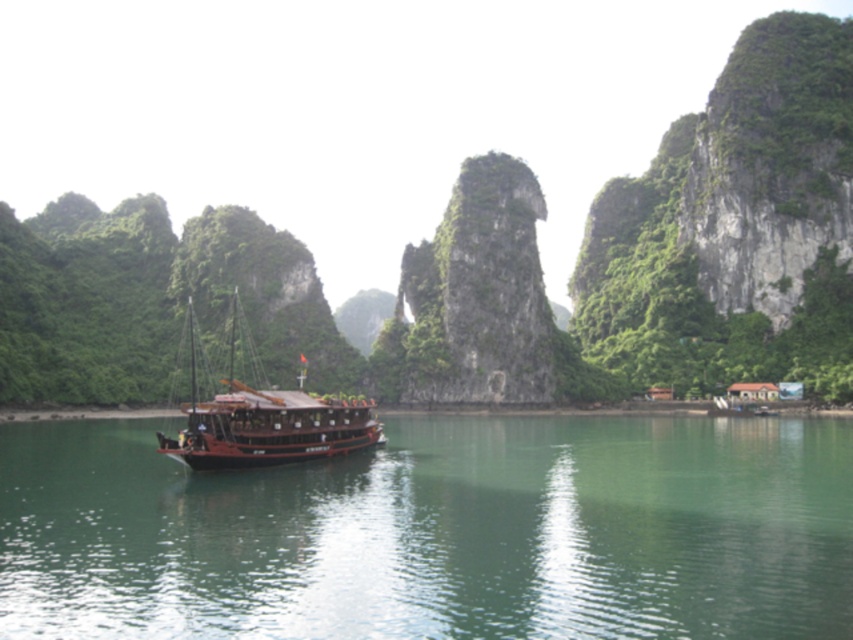
Question: Does green smooth water at center have a greater width compared to wooden ship at center?

Choices:
 (A) no
 (B) yes

Answer: (B)

Question: Which point is closer to the camera?

Choices:
 (A) (579, 556)
 (B) (302, 390)

Answer: (A)

Question: Is green smooth water at center in front of wooden ship at center?

Choices:
 (A) no
 (B) yes

Answer: (B)

Question: Which object is farther from the camera taking this photo?

Choices:
 (A) green smooth water at center
 (B) wooden ship at center

Answer: (B)

Question: Is green smooth water at center positioned before wooden ship at center?

Choices:
 (A) yes
 (B) no

Answer: (A)